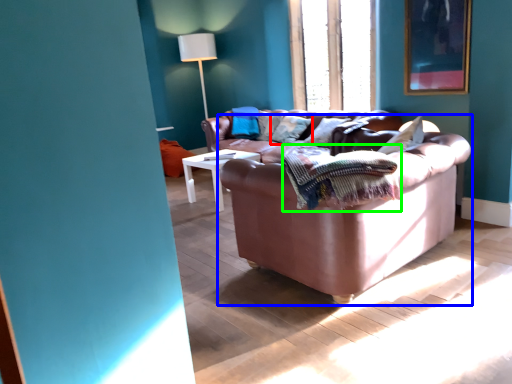
Question: Estimate the real-world distances between objects in this image. Which object is farther from pillow (highlighted by a red box), studio couch (highlighted by a blue box) or blanket (highlighted by a green box)?

Choices:
 (A) studio couch
 (B) blanket

Answer: (B)